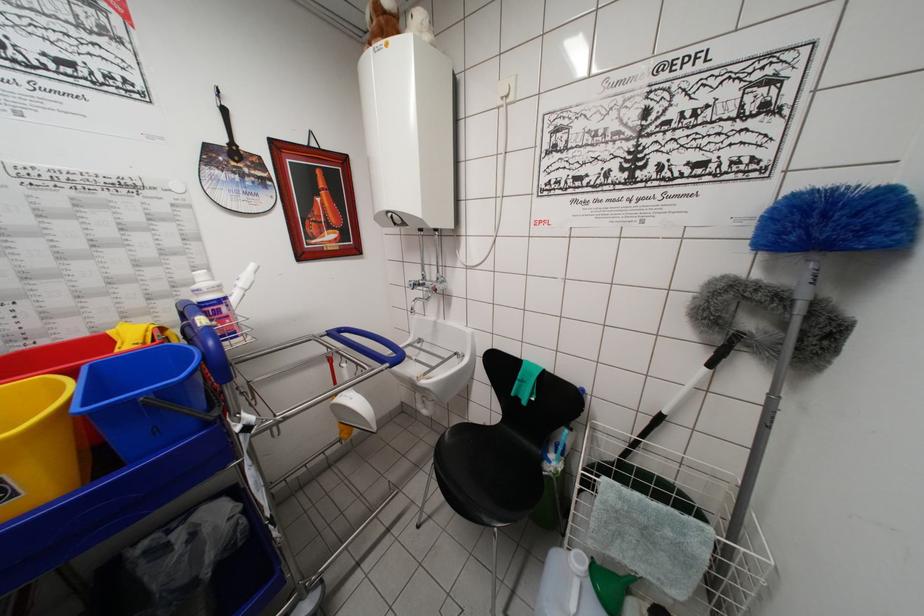
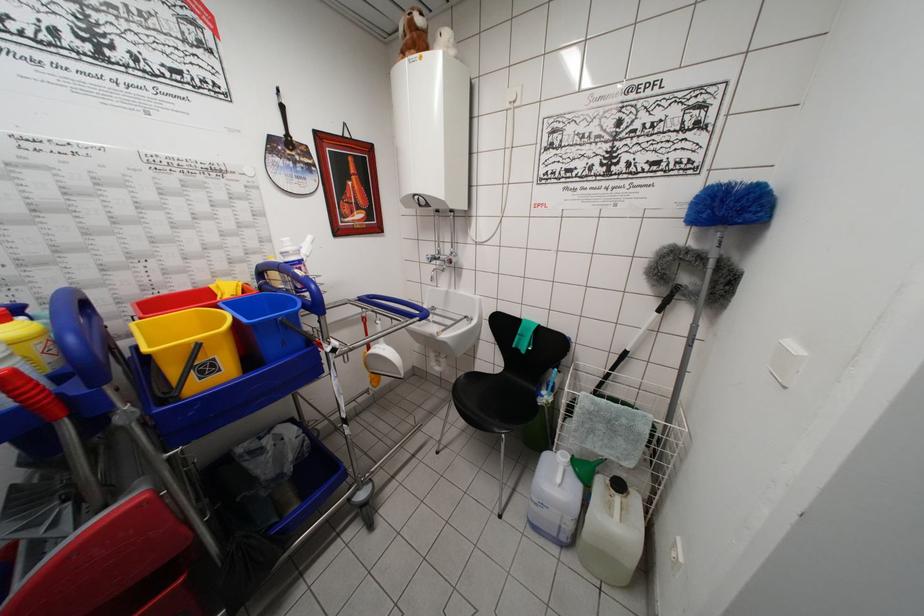
In the second image, find the point that corresponds to point (576, 557) in the first image.

(563, 456)